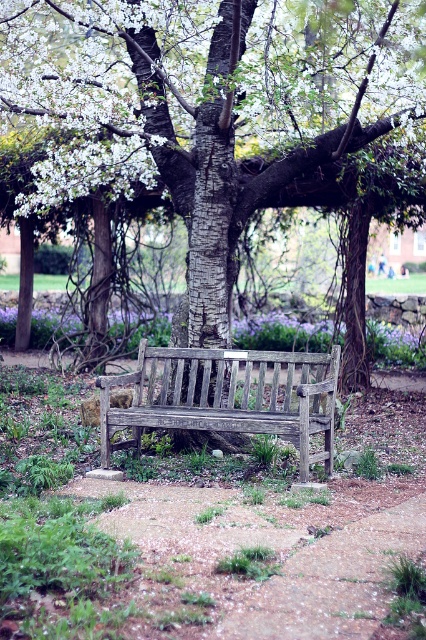
You are standing at the origin point in the image. The weathered wood bench at center is located at coordinates given in the description. If you want to walk directly to the bench, which direction should you move in?

The weathered wood bench at center is located at coordinates point [227,396]. Since you are at the origin point, you should move towards the bench by heading in the direction of increasing x and y coordinates to reach it.

You are planning to arrange a floral display using the white blossoms at center and the purple matte flower at center. If you want to create a symmetrical arrangement where the wider flower is placed on the left side, which flower should be positioned on the left?

The white blossoms at center should be positioned on the left side since their width surpasses that of the purple matte flower at center, making them the wider option for the symmetrical arrangement.